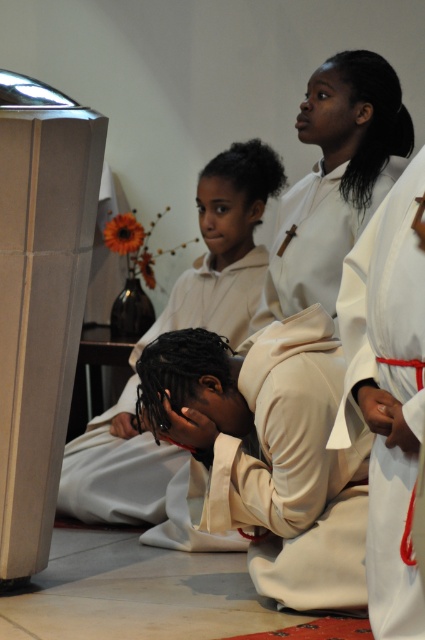
Question: Is white matte cross at upper center wider than white matte hair at upper center?

Choices:
 (A) no
 (B) yes

Answer: (B)

Question: Can you confirm if white matte/soft preacher at lower center is thinner than white matte hair at upper center?

Choices:
 (A) no
 (B) yes

Answer: (A)

Question: Is white matte robe at center below white matte cross at upper center?

Choices:
 (A) yes
 (B) no

Answer: (A)

Question: Among these objects, which one is farthest from the camera?

Choices:
 (A) white matte hair at upper center
 (B) white matte/soft preacher at lower center

Answer: (A)

Question: Which is nearer to the white matte cross at upper center?

Choices:
 (A) white matte robe at lower center
 (B) satin white hair at center
 (C) white matte robe at center
 (D) white matte hair at upper center

Answer: (D)

Question: Which is nearer to the smooth white head at lower center?

Choices:
 (A) white matte robe at center
 (B) white matte robe at lower center

Answer: (A)